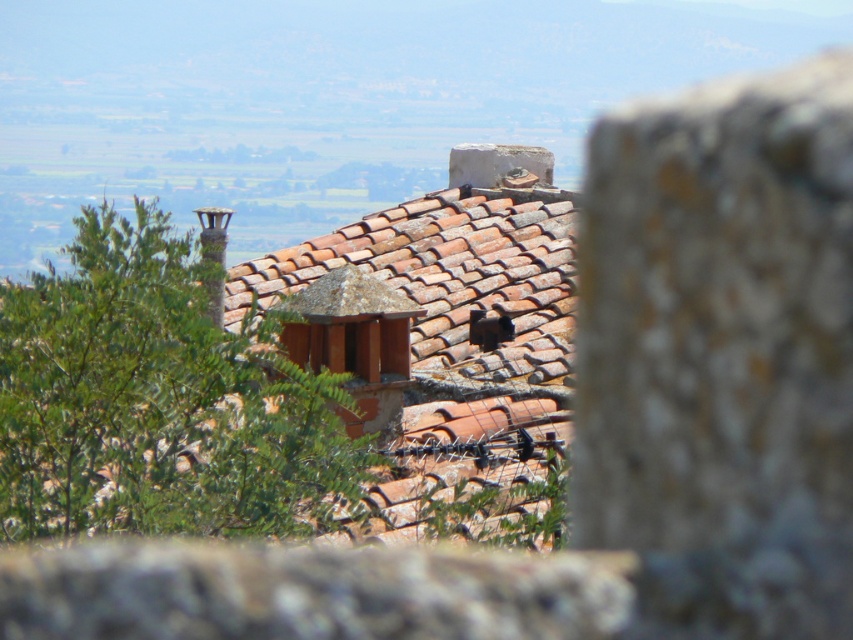
Question: Among these points, which one is farthest from the camera?

Choices:
 (A) tap(160, 480)
 (B) tap(372, 234)
 (C) tap(537, 164)

Answer: (C)

Question: Which object appears farthest from the camera in this image?

Choices:
 (A) green leafy tree at left
 (B) terracotta tiles at center

Answer: (B)

Question: Estimate the real-world distances between objects in this image. Which object is farther from the terracotta tiles at center?

Choices:
 (A) green leafy tree at left
 (B) white stone at center

Answer: (B)

Question: In this image, where is terracotta tiles at center located relative to white stone at center?

Choices:
 (A) below
 (B) above

Answer: (A)

Question: Can you confirm if green leafy tree at left is bigger than white stone at center?

Choices:
 (A) yes
 (B) no

Answer: (B)

Question: Observing the image, what is the correct spatial positioning of terracotta tiles at center in reference to white stone at center?

Choices:
 (A) left
 (B) right

Answer: (A)